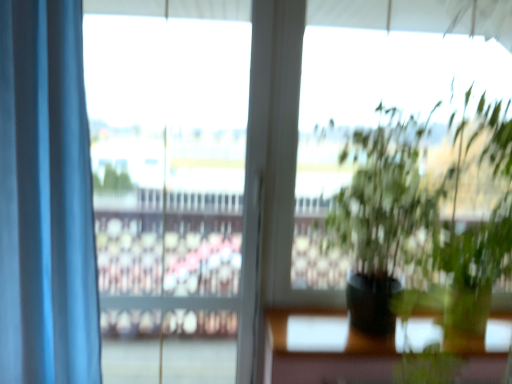
What do you see at coordinates (46, 199) in the screenshot? This screenshot has width=512, height=384. I see `blue fabric curtain at left` at bounding box center [46, 199].

In order to face blue fabric curtain at left, should I rotate leftwards or rightwards?

You should rotate left by 25.808 degrees.

Find the location of a particular element. Image resolution: width=512 pixels, height=384 pixels. blue fabric curtain at left is located at coordinates (46, 199).

The width and height of the screenshot is (512, 384). What do you see at coordinates (168, 191) in the screenshot? I see `clear glass window at center` at bounding box center [168, 191].

Locate an element on the screen. clear glass window at center is located at coordinates (168, 191).

Locate an element on the screen. blue fabric curtain at left is located at coordinates (46, 199).

Would you say blue fabric curtain at left is to the left or to the right of clear glass window at center in the picture?

Clearly, blue fabric curtain at left is on the left of clear glass window at center in the image.

Who is more distant, blue fabric curtain at left or clear glass window at center?

clear glass window at center is behind.

Which point is more distant from viewer, (12, 257) or (149, 265)?

The point (149, 265) is behind.

From the image's perspective, which one is positioned higher, blue fabric curtain at left or clear glass window at center?

blue fabric curtain at left, from the image's perspective.

From a real-world perspective, is blue fabric curtain at left above or below clear glass window at center?

Clearly, from a real-world perspective, blue fabric curtain at left is above clear glass window at center.

Considering the sizes of objects blue fabric curtain at left and clear glass window at center in the image provided, who is wider, blue fabric curtain at left or clear glass window at center?

blue fabric curtain at left is wider.

From their relative heights in the image, would you say blue fabric curtain at left is taller or shorter than clear glass window at center?

Clearly, blue fabric curtain at left is shorter compared to clear glass window at center.

Is blue fabric curtain at left bigger than clear glass window at center?

Yes, blue fabric curtain at left is bigger than clear glass window at center.

Choose the correct answer: Is blue fabric curtain at left inside clear glass window at center or outside it?

blue fabric curtain at left is outside clear glass window at center.

Is blue fabric curtain at left in contact with clear glass window at center?

No.

Is clear glass window at center at the back of blue fabric curtain at left?

Yes.

Locate an element on the screen. The image size is (512, 384). window frame located below the blue fabric curtain at left (from the image's perspective) is located at coordinates (168, 191).

Between clear glass window at center and blue fabric curtain at left, which one appears on the right side from the viewer's perspective?

From the viewer's perspective, clear glass window at center appears more on the right side.

Is clear glass window at center closer to camera compared to blue fabric curtain at left?

No, clear glass window at center is further to the viewer.

Does point (236, 270) lie behind point (60, 285)?

Yes, it is behind point (60, 285).

From the image's perspective, is clear glass window at center above or below blue fabric curtain at left?

clear glass window at center is situated lower than blue fabric curtain at left in the image.

From a real-world perspective, which object rests below the other?

clear glass window at center.

Considering the relative sizes of clear glass window at center and blue fabric curtain at left in the image provided, is clear glass window at center thinner than blue fabric curtain at left?

Yes, clear glass window at center is thinner than blue fabric curtain at left.

Between clear glass window at center and blue fabric curtain at left, which one has more height?

With more height is clear glass window at center.

Based on their sizes in the image, would you say clear glass window at center is bigger or smaller than blue fabric curtain at left?

Clearly, clear glass window at center is smaller in size than blue fabric curtain at left.

Is blue fabric curtain at left located within clear glass window at center?

Actually, blue fabric curtain at left is outside clear glass window at center.

Is there a large distance between clear glass window at center and blue fabric curtain at left?

clear glass window at center is far away from blue fabric curtain at left.

Is clear glass window at center looking in the opposite direction of blue fabric curtain at left?

No, clear glass window at center is not facing away from blue fabric curtain at left.

How many degrees apart are the facing directions of clear glass window at center and blue fabric curtain at left?

1.66 degrees.

How far apart are clear glass window at center and blue fabric curtain at left?

They are 2.01 meters apart.

You are a GUI agent. You are given a task and a screenshot of the screen. Output one action in this format:
    pyautogui.click(x=<x>, y=<y>)
    Task: Click on the window frame behind the blue fabric curtain at left
    Image resolution: width=512 pixels, height=384 pixels.
    Given the screenshot: What is the action you would take?
    pyautogui.click(x=168, y=191)

At what (x,y) coordinates should I click in order to perform the action: click on window frame behind the blue fabric curtain at left. Please return your answer as a coordinate pair (x, y). Image resolution: width=512 pixels, height=384 pixels. Looking at the image, I should click on (168, 191).

Locate an element on the screen. The height and width of the screenshot is (384, 512). curtain that is above the clear glass window at center (from the image's perspective) is located at coordinates (46, 199).